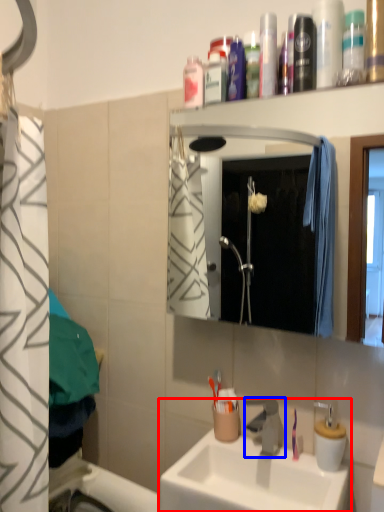
Question: Which point is further to the camera, sink (highlighted by a red box) or tap (highlighted by a blue box)?

Choices:
 (A) sink
 (B) tap

Answer: (B)